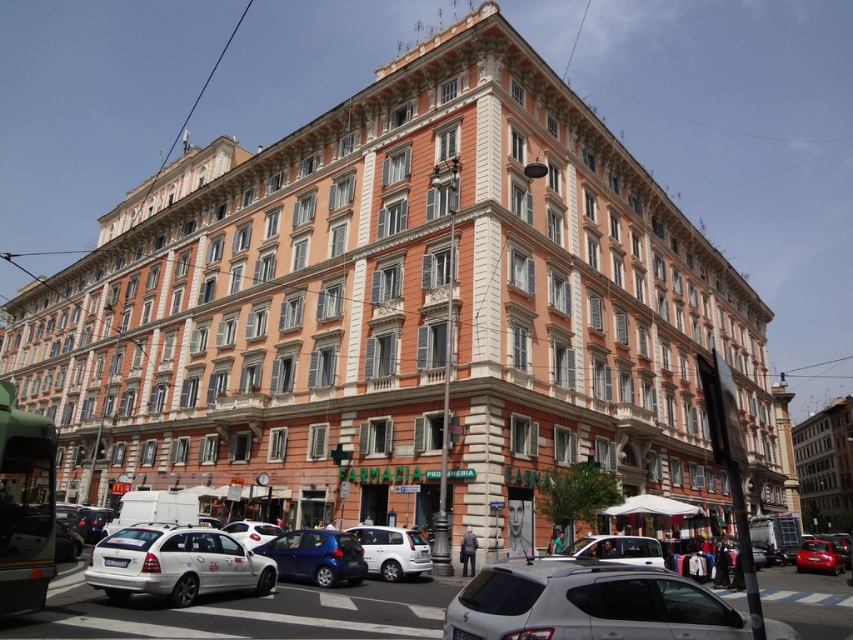
You are standing on the street looking at the building. A friend tells you that there is a point at coordinates point (397, 547) that is 47.47 meters away from you. Is this point located on the building or somewhere else?

The point at coordinates point (397, 547) is 47.47 meters away from the viewer, so it is likely located on the building since it is part of the scene described.

You are a delivery person who needs to park your delivery van, which is 1.8 meters tall, in this urban street scene. You see the white matte car at lower center and the metallic blue car at center. Can you determine if your van can fit between them vertically?

The white matte car at lower center is much taller than the metallic blue car at center. Since the van is 1.8 meters tall, it may not fit if the space between the cars is constrained by the height of the taller white matte car at lower center. However, without knowing the exact clearance between the cars, it is uncertain. Please check the actual space before proceeding.

You are a pedestrian standing in front of the Farmacia. You need to cross the street to reach the shiny red car at lower right. Is the white matte van at lower center blocking your path?

The white matte van at lower center is closer to the viewer than the shiny red car at lower right, so the van is blocking the path to the car.